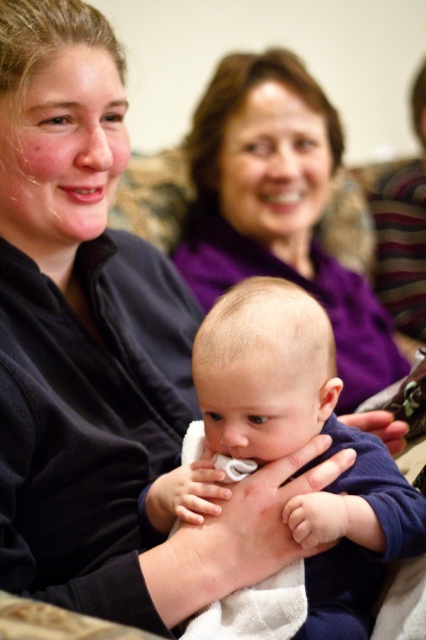
Is smooth blue shirt at center wider than purple fabric at upper center?

In fact, smooth blue shirt at center might be narrower than purple fabric at upper center.

Can you confirm if smooth blue shirt at center is bigger than purple fabric at upper center?

No, smooth blue shirt at center is not bigger than purple fabric at upper center.

Describe the element at coordinates (304, 444) in the screenshot. I see `smooth blue shirt at center` at that location.

Where is `smooth blue shirt at center`? smooth blue shirt at center is located at coordinates (304, 444).